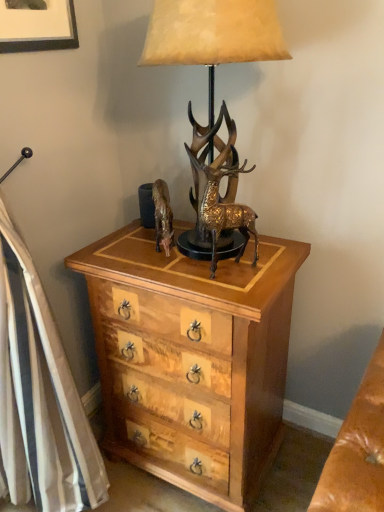
Locate an element on the screen. vacant space to the right of gold textured deer at center is located at coordinates (272, 265).